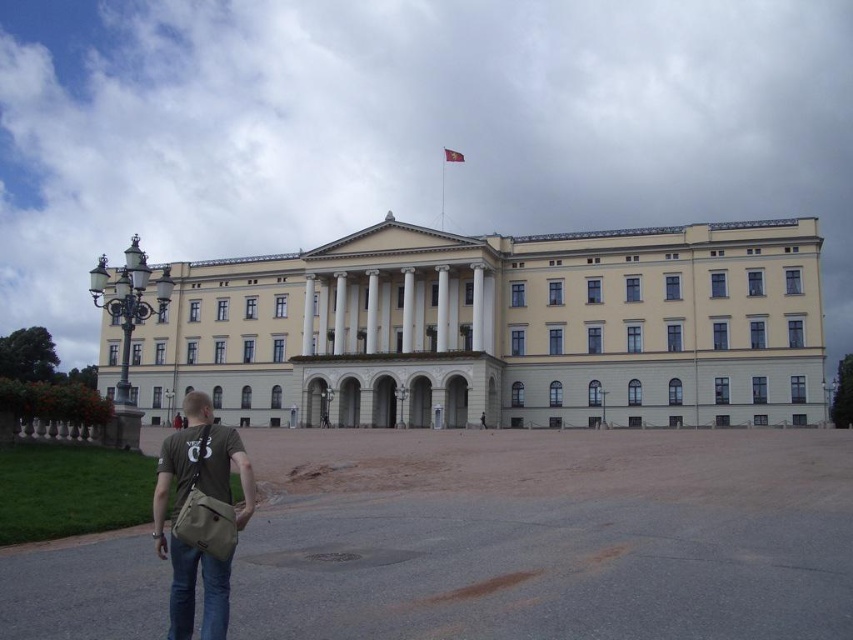
You are a photographer planning to capture the yellow stone building at center and the khaki canvas bag at lower left in a single frame. Considering their sizes, which object will occupy more space in the photo?

The yellow stone building at center will occupy more space in the photo because its width surpasses that of the khaki canvas bag at lower left.

You are standing in front of the grand neoclassical building and notice a khaki canvas bag at lower left. Where exactly is the khaki canvas bag located in terms of coordinates?

The khaki canvas bag at lower left is located at point (181, 508).

You are a tourist standing in the plaza in front of the yellow stone building at center. You see the khaki canvas bag at lower left lying on the ground. Can you pick it up without leaving the plaza?

The yellow stone building at center is much larger than the khaki canvas bag at lower left, so the plaza around the building should have enough space for you to approach and pick up the khaki canvas bag at lower left without leaving the plaza.